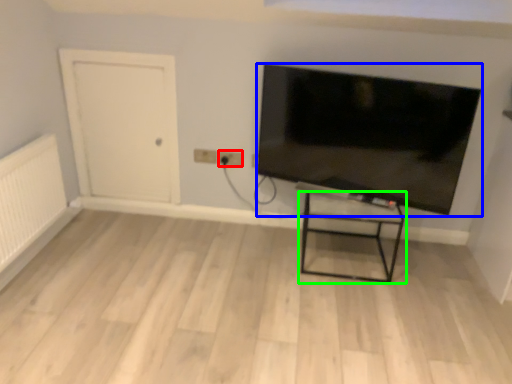
Question: Which object is positioned farthest from electric outlet (highlighted by a red box)? Select from television (highlighted by a blue box) and furniture (highlighted by a green box).

Choices:
 (A) television
 (B) furniture

Answer: (B)